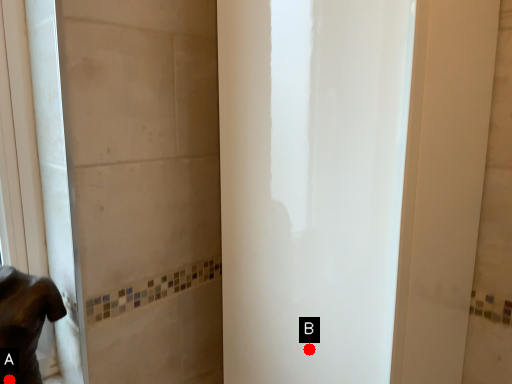
Question: Two points are circled on the image, labeled by A and B beside each circle. Which point is closer to the camera?

Choices:
 (A) A is closer
 (B) B is closer

Answer: (A)